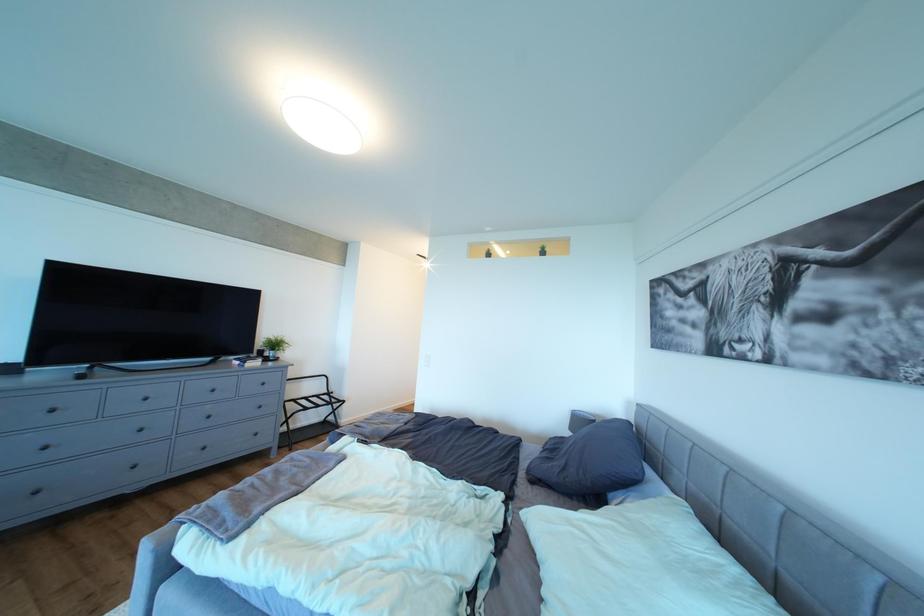
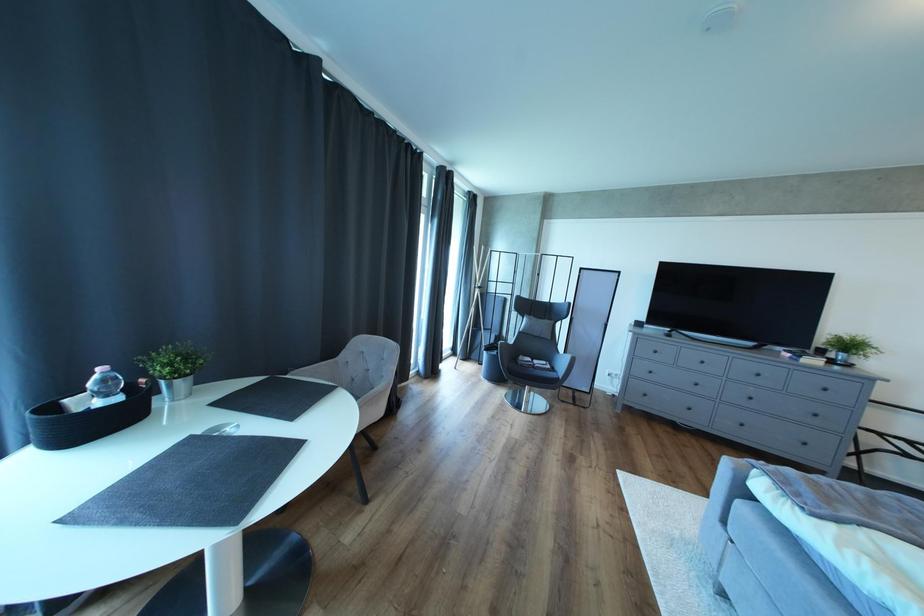
Question: The first image is from the beginning of the video and the second image is from the end. How did the camera likely rotate when shooting the video?

Choices:
 (A) Left
 (B) Right
 (C) Up
 (D) Down

Answer: (A)